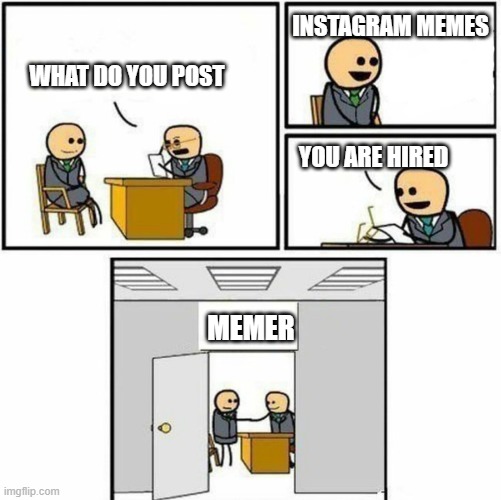
The image size is (501, 500). What are the coordinates of `door knob` in the screenshot? It's located at (164, 425), (150, 427).